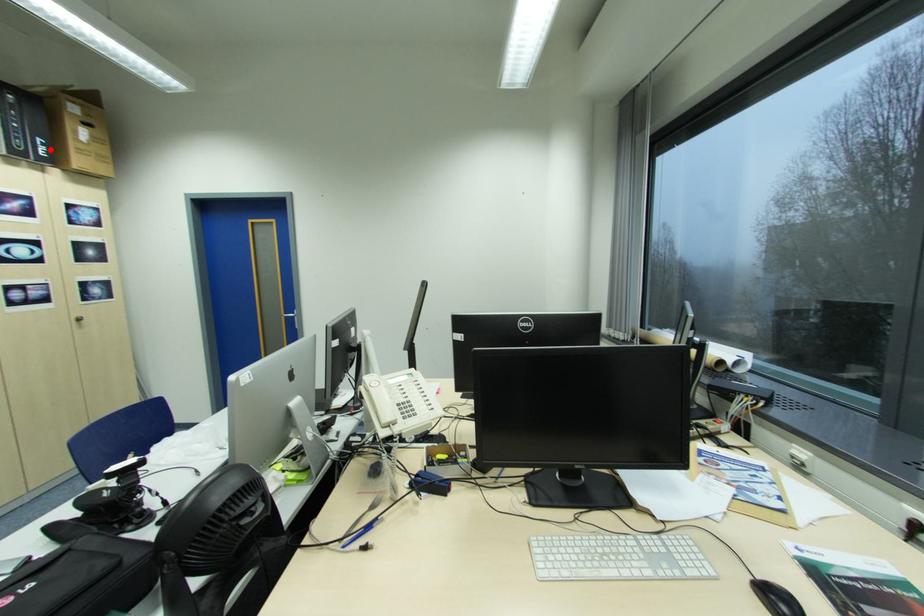
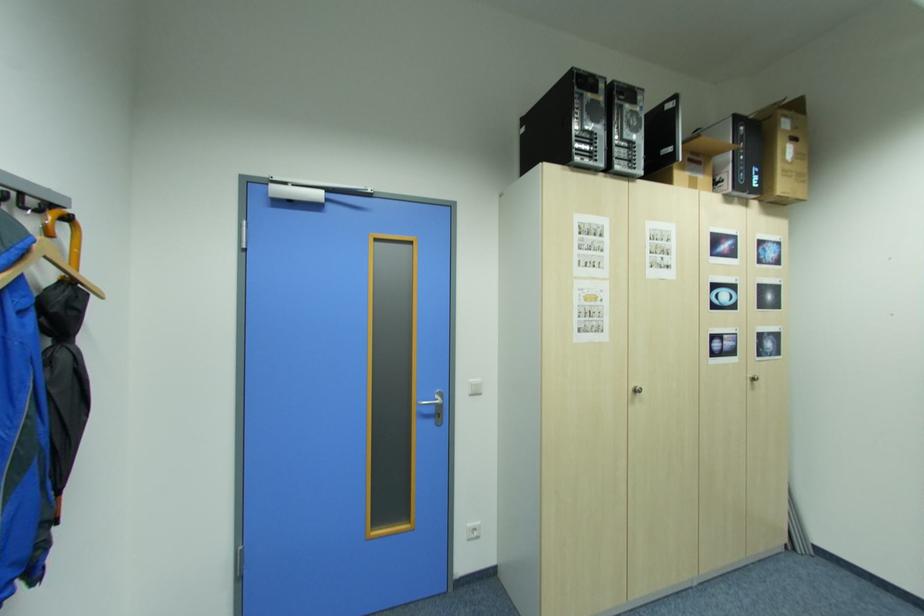
The point at the highlighted location is marked in the first image. Where is the corresponding point in the second image?

(762, 179)